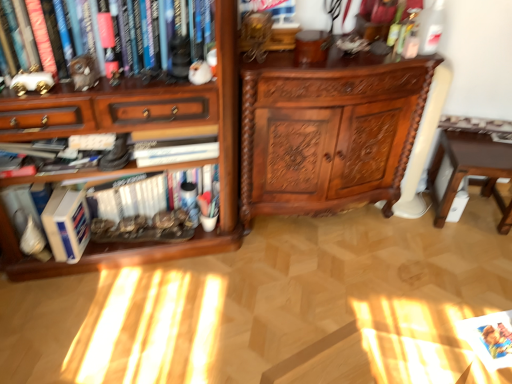
What do you see at coordinates (131, 131) in the screenshot?
I see `wooden bookcase at left` at bounding box center [131, 131].

Image resolution: width=512 pixels, height=384 pixels. What are the coordinates of `wooden bookcase at left` in the screenshot? It's located at (131, 131).

From the wooden bookcase at left, count 1st books backward and point to it. Please provide its 2D coordinates.

[(53, 38)]

Considering the points (153, 0) and (128, 263), which point is in front, point (153, 0) or point (128, 263)?

Positioned in front is point (153, 0).

Can wooden bookcase at left be found inside matte white figurine at upper left, the 1th book when ordered from top to bottom?

Actually, wooden bookcase at left is outside matte white figurine at upper left, the 1th book when ordered from top to bottom.

Who is shorter, matte white figurine at upper left, positioned as the second book in back-to-front order, or wooden bookcase at left?

matte white figurine at upper left, positioned as the second book in back-to-front order.

From the image's perspective, relative to matte white figurine at upper left, placed as the second book when sorted from bottom to top, is polished wood cabinet at center above or below?

polished wood cabinet at center is situated lower than matte white figurine at upper left, placed as the second book when sorted from bottom to top, in the image.

Considering the positions of point (387, 71) and point (53, 72), is point (387, 71) closer or farther from the camera than point (53, 72)?

Point (387, 71) appears to be farther away from the viewer than point (53, 72).

How different are the orientations of polished wood cabinet at center and matte white figurine at upper left, arranged as the 1th book when viewed from the front, in degrees?

1.2 degrees separate the facing orientations of polished wood cabinet at center and matte white figurine at upper left, arranged as the 1th book when viewed from the front.

Locate an element on the screen. table that is on the right side of wooden bookcase at left is located at coordinates (471, 170).

Looking at this image, does wooden bookcase at left have a greater width compared to brown wooden table at lower right?

Yes.

From the image's perspective, which one is positioned lower, wooden bookcase at left or brown wooden table at lower right?

brown wooden table at lower right, from the image's perspective.

Can you confirm if brown wooden table at lower right is taller than hardcover book at left, placed as the second book when sorted from front to back?

Correct, brown wooden table at lower right is much taller as hardcover book at left, placed as the second book when sorted from front to back.

Is hardcover book at left, the first book in the bottom-to-top sequence, located within brown wooden table at lower right?

No, hardcover book at left, the first book in the bottom-to-top sequence, is located outside of brown wooden table at lower right.

From the image's perspective, relative to hardcover book at left, the first book in the bottom-to-top sequence, is brown wooden table at lower right above or below?

Based on their image positions, brown wooden table at lower right is located above hardcover book at left, the first book in the bottom-to-top sequence.

Considering the relative positions of brown wooden table at lower right and hardcover book at left, the first book when ordered from back to front, in the image provided, is brown wooden table at lower right behind hardcover book at left, the first book when ordered from back to front,?

That is True.

How different are the orientations of matte white figurine at upper left, placed as the second book when sorted from bottom to top, and polished wood cabinet at center in degrees?

1.2 degrees separate the facing orientations of matte white figurine at upper left, placed as the second book when sorted from bottom to top, and polished wood cabinet at center.

Based on the photo, is matte white figurine at upper left, arranged as the 1th book when viewed from the front, wider or thinner than polished wood cabinet at center?

Considering their sizes, matte white figurine at upper left, arranged as the 1th book when viewed from the front, looks slimmer than polished wood cabinet at center.

Considering the sizes of objects matte white figurine at upper left, placed as the second book when sorted from bottom to top, and polished wood cabinet at center in the image provided, who is taller, matte white figurine at upper left, placed as the second book when sorted from bottom to top, or polished wood cabinet at center?

With more height is polished wood cabinet at center.

Locate an element on the screen. book in front of the polished wood cabinet at center is located at coordinates (53, 38).

Between polished wood cabinet at center and wooden bookcase at left, which one has more height?

Standing taller between the two is wooden bookcase at left.

In terms of size, does polished wood cabinet at center appear bigger or smaller than wooden bookcase at left?

Clearly, polished wood cabinet at center is smaller in size than wooden bookcase at left.

Considering the relative sizes of polished wood cabinet at center and wooden bookcase at left in the image provided, is polished wood cabinet at center thinner than wooden bookcase at left?

Indeed, polished wood cabinet at center has a lesser width compared to wooden bookcase at left.

Could you tell me if polished wood cabinet at center is facing wooden bookcase at left?

No, polished wood cabinet at center is not facing towards wooden bookcase at left.

Do you think polished wood cabinet at center is within hardcover book at left, the first book when ordered from back to front, or outside of it?

polished wood cabinet at center exists outside the volume of hardcover book at left, the first book when ordered from back to front.

Who is smaller, polished wood cabinet at center or hardcover book at left, the first book in the bottom-to-top sequence?

Smaller between the two is hardcover book at left, the first book in the bottom-to-top sequence.

Where is `book beneath the polished wood cabinet at center (from a real-world perspective)`? The image size is (512, 384). book beneath the polished wood cabinet at center (from a real-world perspective) is located at coordinates (143, 193).

Looking at this image, from the image's perspective, is polished wood cabinet at center located above or below hardcover book at left, the first book when ordered from back to front?

From the image's perspective, polished wood cabinet at center appears above hardcover book at left, the first book when ordered from back to front.

Locate an element on the screen. This screenshot has width=512, height=384. book that is the 1st one when counting backward from the wooden bookcase at left is located at coordinates (53, 38).

Find the location of a particular element. book located above the polished wood cabinet at center (from a real-world perspective) is located at coordinates (53, 38).

In the scene shown: From the image, which object appears to be nearer to hardcover book at left, which is the 2th book in top-to-bottom order, brown wooden table at lower right or matte white figurine at upper left, arranged as the 1th book when viewed from the front?

The object closer to hardcover book at left, which is the 2th book in top-to-bottom order, is matte white figurine at upper left, arranged as the 1th book when viewed from the front.

Based on their spatial positions, is wooden bookcase at left or polished wood cabinet at center closer to brown wooden table at lower right?

polished wood cabinet at center is closer to brown wooden table at lower right.

Which object lies nearer to the anchor point hardcover book at left, placed as the second book when sorted from front to back, wooden bookcase at left or polished wood cabinet at center?

wooden bookcase at left.

Which object lies further to the anchor point hardcover book at left, the first book when ordered from back to front, wooden bookcase at left or brown wooden table at lower right?

Based on the image, brown wooden table at lower right appears to be further to hardcover book at left, the first book when ordered from back to front.

Estimate the real-world distances between objects in this image. Which object is closer to hardcover book at left, which is the 2th book in top-to-bottom order, wooden bookcase at left or matte white figurine at upper left, arranged as the 1th book when viewed from the front?

wooden bookcase at left.

Considering their positions, is polished wood cabinet at center positioned closer to brown wooden table at lower right than hardcover book at left, which is the 2th book in top-to-bottom order?

polished wood cabinet at center is positioned closer to the anchor brown wooden table at lower right.

Considering their positions, is matte white figurine at upper left, arranged as the 1th book when viewed from the front, positioned closer to brown wooden table at lower right than polished wood cabinet at center?

Based on the image, polished wood cabinet at center appears to be nearer to brown wooden table at lower right.

When comparing their distances from brown wooden table at lower right, does wooden bookcase at left or hardcover book at left, the first book when ordered from back to front, seem closer?

wooden bookcase at left.

At what (x,y) coordinates should I click in order to perform the action: click on bookcase between hardcover book at left, placed as the second book when sorted from front to back, and brown wooden table at lower right from left to right. Please return your answer as a coordinate pair (x, y). The width and height of the screenshot is (512, 384). Looking at the image, I should click on click(131, 131).

Identify the location of the chest of drawers located between wooden bookcase at left and brown wooden table at lower right in the left-right direction. (328, 132).

Locate an element on the screen. bookcase located between matte white figurine at upper left, positioned as the second book in back-to-front order, and polished wood cabinet at center in the left-right direction is located at coordinates (131, 131).

Where is `chest of drawers between hardcover book at left, the first book in the bottom-to-top sequence, and brown wooden table at lower right, in the horizontal direction`? The width and height of the screenshot is (512, 384). chest of drawers between hardcover book at left, the first book in the bottom-to-top sequence, and brown wooden table at lower right, in the horizontal direction is located at coordinates (328, 132).